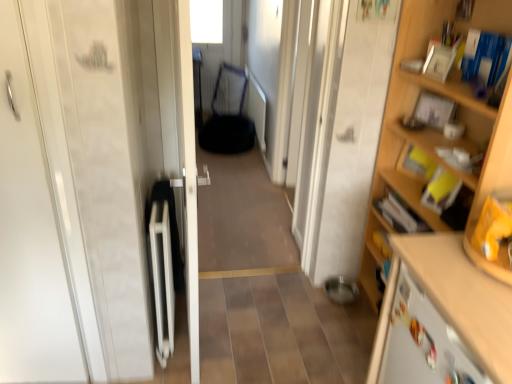
Question: Can you confirm if wooden cabinet at lower right is positioned to the left of wooden shelf at right?

Choices:
 (A) no
 (B) yes

Answer: (B)

Question: Is wooden cabinet at lower right positioned far away from wooden shelf at right?

Choices:
 (A) no
 (B) yes

Answer: (A)

Question: Is wooden cabinet at lower right positioned beyond the bounds of wooden shelf at right?

Choices:
 (A) yes
 (B) no

Answer: (A)

Question: Is wooden cabinet at lower right positioned with its back to wooden shelf at right?

Choices:
 (A) yes
 (B) no

Answer: (B)

Question: Can you confirm if wooden cabinet at lower right is thinner than wooden shelf at right?

Choices:
 (A) yes
 (B) no

Answer: (B)

Question: Considering the positions of point pyautogui.click(x=397, y=284) and point pyautogui.click(x=210, y=144), is point pyautogui.click(x=397, y=284) closer or farther from the camera than point pyautogui.click(x=210, y=144)?

Choices:
 (A) farther
 (B) closer

Answer: (B)

Question: From a real-world perspective, is wooden cabinet at lower right positioned above or below metallic mesh armchair at center?

Choices:
 (A) above
 (B) below

Answer: (A)

Question: Looking at their shapes, would you say wooden cabinet at lower right is wider or thinner than metallic mesh armchair at center?

Choices:
 (A) wide
 (B) thin

Answer: (A)

Question: From the image's perspective, is wooden cabinet at lower right positioned above or below metallic mesh armchair at center?

Choices:
 (A) below
 (B) above

Answer: (A)

Question: From the image's perspective, relative to wooden shelf at right, is metallic mesh armchair at center above or below?

Choices:
 (A) below
 (B) above

Answer: (B)

Question: Would you say metallic mesh armchair at center is to the left or to the right of wooden shelf at right in the picture?

Choices:
 (A) right
 (B) left

Answer: (B)

Question: Considering the positions of metallic mesh armchair at center and wooden shelf at right in the image, is metallic mesh armchair at center bigger or smaller than wooden shelf at right?

Choices:
 (A) big
 (B) small

Answer: (B)

Question: Is metallic mesh armchair at center wider or thinner than wooden shelf at right?

Choices:
 (A) wide
 (B) thin

Answer: (B)

Question: Looking at their shapes, would you say white glossy door at center, which is the first door in right-to-left order, is wider or thinner than wooden cabinet at lower right?

Choices:
 (A) wide
 (B) thin

Answer: (B)

Question: Is point (188, 256) positioned closer to the camera than point (468, 309)?

Choices:
 (A) closer
 (B) farther

Answer: (B)